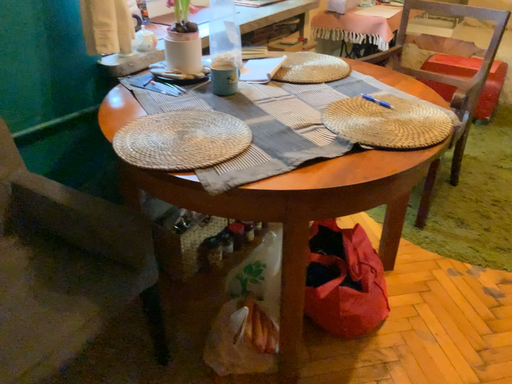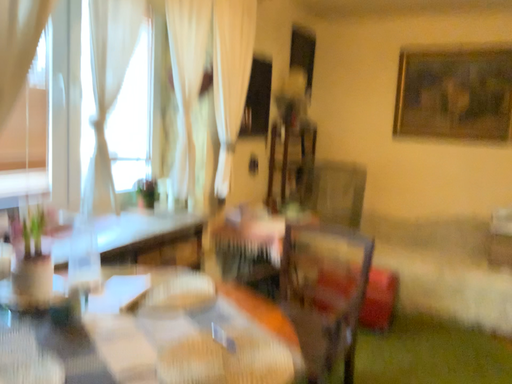
Question: How did the camera likely rotate when shooting the video?

Choices:
 (A) rotated right
 (B) rotated left

Answer: (A)